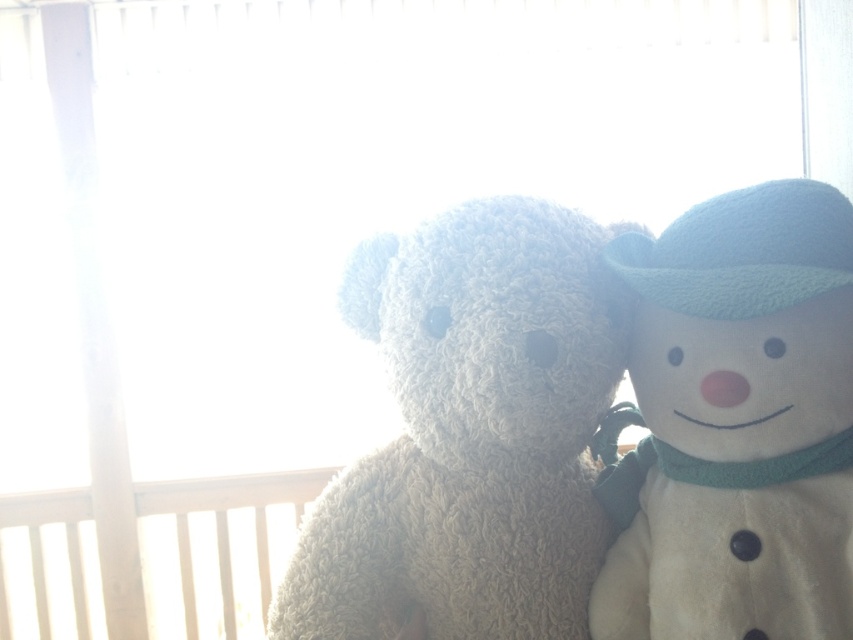
Question: Is fluffy beige teddy bear at center thinner than white plush snowman at right?

Choices:
 (A) no
 (B) yes

Answer: (A)

Question: Which point is closer to the camera taking this photo?

Choices:
 (A) (735, 561)
 (B) (509, 595)

Answer: (A)

Question: Can you confirm if fluffy beige teddy bear at center is bigger than white plush snowman at right?

Choices:
 (A) no
 (B) yes

Answer: (B)

Question: From the image, what is the correct spatial relationship of fluffy beige teddy bear at center in relation to white plush snowman at right?

Choices:
 (A) above
 (B) below

Answer: (B)

Question: Which point appears closest to the camera in this image?

Choices:
 (A) (848, 282)
 (B) (589, 372)

Answer: (A)